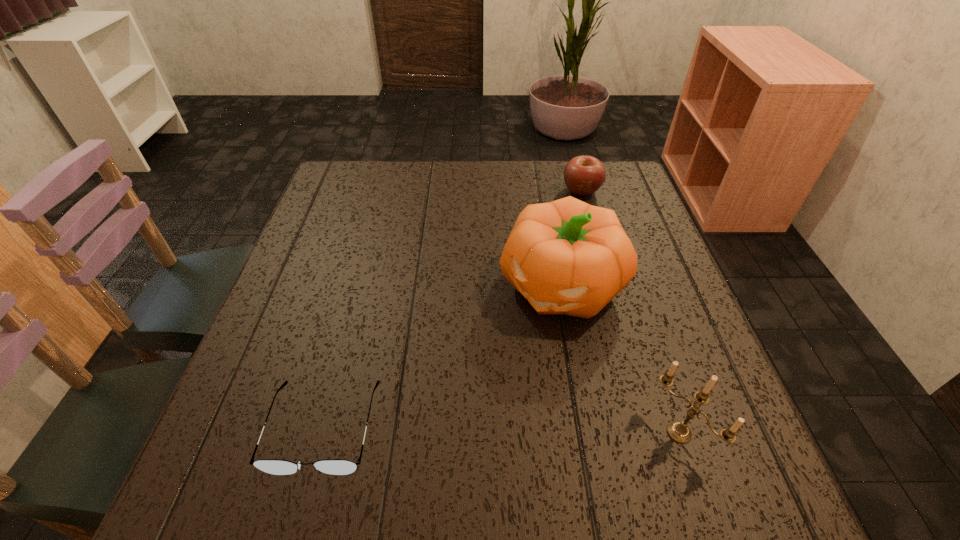
At what (x,y) coordinates should I click in order to perform the action: click on blank area located on the side of the second shortest object with the unique marking. Please return your answer as a coordinate pair (x, y). Looking at the image, I should click on (538, 273).

Where is `blank space located 0.080m on the carved face of the tallest object`? This screenshot has height=540, width=960. blank space located 0.080m on the carved face of the tallest object is located at coordinates (513, 352).

Where is `free space located 0.290m on the carved face of the tallest object`? The height and width of the screenshot is (540, 960). free space located 0.290m on the carved face of the tallest object is located at coordinates (451, 440).

What are the coordinates of `vacant region located on the carved face of the tallest object` in the screenshot? It's located at (483, 394).

The width and height of the screenshot is (960, 540). What are the coordinates of `object at the far edge` in the screenshot? It's located at (583, 175).

Identify the location of spectacles that is at the near edge. The image size is (960, 540). (272, 466).

Where is `candle that is positioned at the near edge`? The width and height of the screenshot is (960, 540). candle that is positioned at the near edge is located at coordinates (678, 431).

What are the coordinates of `object that is positioned at the left edge` in the screenshot? It's located at (272, 466).

I want to click on candle located at the right edge, so click(x=678, y=431).

The height and width of the screenshot is (540, 960). I want to click on apple present at the right edge, so [x=583, y=175].